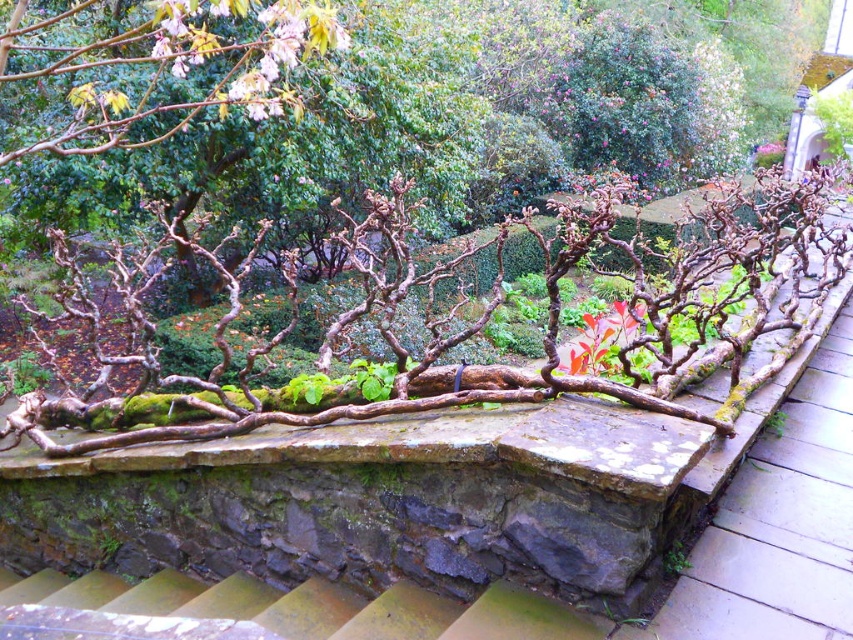
The height and width of the screenshot is (640, 853). What do you see at coordinates (779, 524) in the screenshot?
I see `brown stone path at center` at bounding box center [779, 524].

Who is positioned more to the left, brown stone path at center or glossy red leaf at center?

From the viewer's perspective, glossy red leaf at center appears more on the left side.

Which is in front, point (840, 570) or point (598, 349)?

Positioned in front is point (840, 570).

The image size is (853, 640). Find the location of `brown stone path at center`. brown stone path at center is located at coordinates (779, 524).

Does point (764, 548) come behind point (91, 605)?

No, it is in front of (91, 605).

The height and width of the screenshot is (640, 853). What are the coordinates of `brown stone path at center` in the screenshot? It's located at (779, 524).

Does rusty metal stairs at lower left have a larger size compared to glossy red leaf at center?

Yes, rusty metal stairs at lower left is bigger than glossy red leaf at center.

Who is positioned more to the left, rusty metal stairs at lower left or glossy red leaf at center?

From the viewer's perspective, rusty metal stairs at lower left appears more on the left side.

Which is in front, point (334, 618) or point (608, 346)?

Point (334, 618) is more forward.

The image size is (853, 640). In order to click on rusty metal stairs at lower left in this screenshot , I will do `click(318, 608)`.